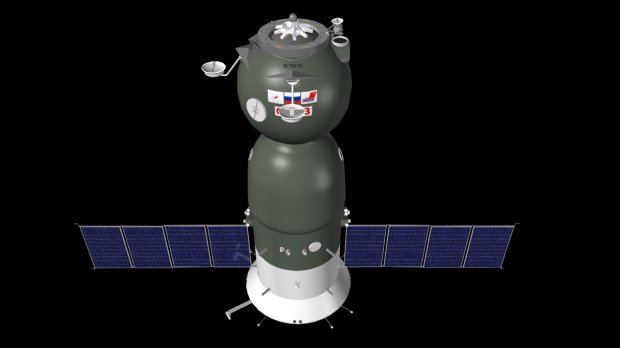
Find the location of `panels on the left`. panels on the left is located at coordinates (108, 250), (149, 253), (190, 244), (229, 250).